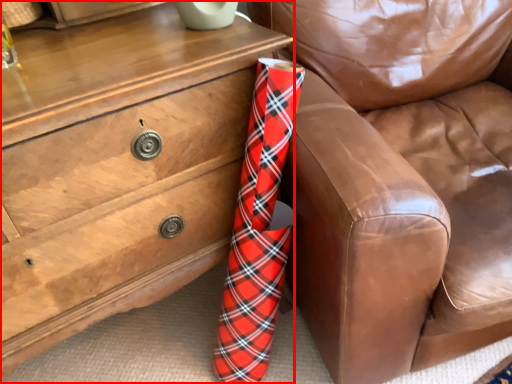
Question: Observing the image, what is the correct spatial positioning of chest of drawers (annotated by the red box) in reference to furniture?

Choices:
 (A) right
 (B) left

Answer: (B)